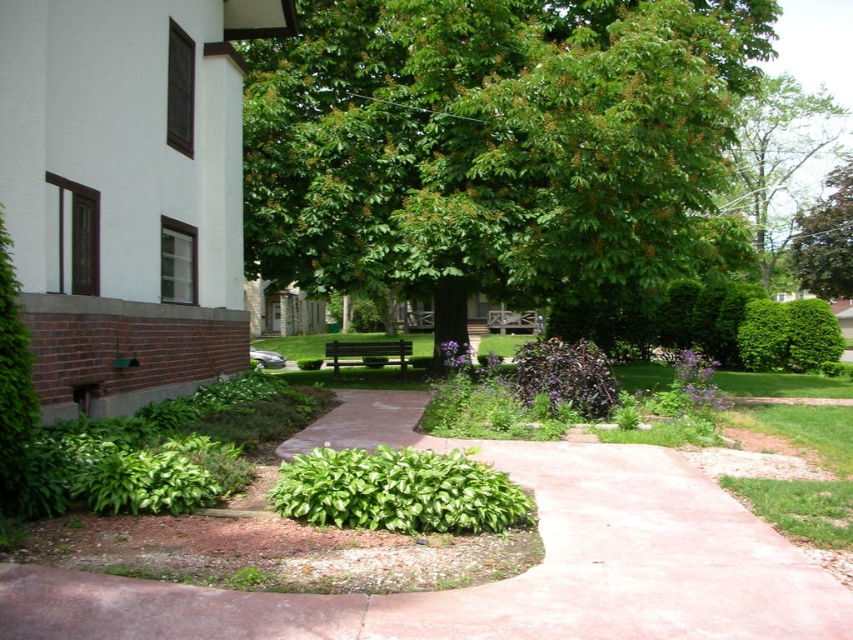
Is green leafy tree at center to the left of purple matte bush at center from the viewer's perspective?

Indeed, green leafy tree at center is positioned on the left side of purple matte bush at center.

This screenshot has width=853, height=640. Find the location of `green leafy tree at center`. green leafy tree at center is located at coordinates (491, 141).

In order to click on green glossy bush at center in this screenshot , I will do `click(398, 492)`.

Is the position of green glossy bush at center more distant than that of wooden park bench at center?

No.

Is point (430, 465) positioned after point (347, 346)?

That is False.

Find the location of a particular element. The width and height of the screenshot is (853, 640). green glossy bush at center is located at coordinates (398, 492).

Can you confirm if green glossy bush at center is thinner than purple matte bush at center?

Yes, green glossy bush at center is thinner than purple matte bush at center.

Is green glossy bush at center below purple matte bush at center?

Yes, green glossy bush at center is below purple matte bush at center.

Measure the distance between point (521, 518) and camera.

The distance of point (521, 518) from camera is 5.03 meters.

This screenshot has width=853, height=640. What are the coordinates of `green glossy bush at center` in the screenshot? It's located at (398, 492).